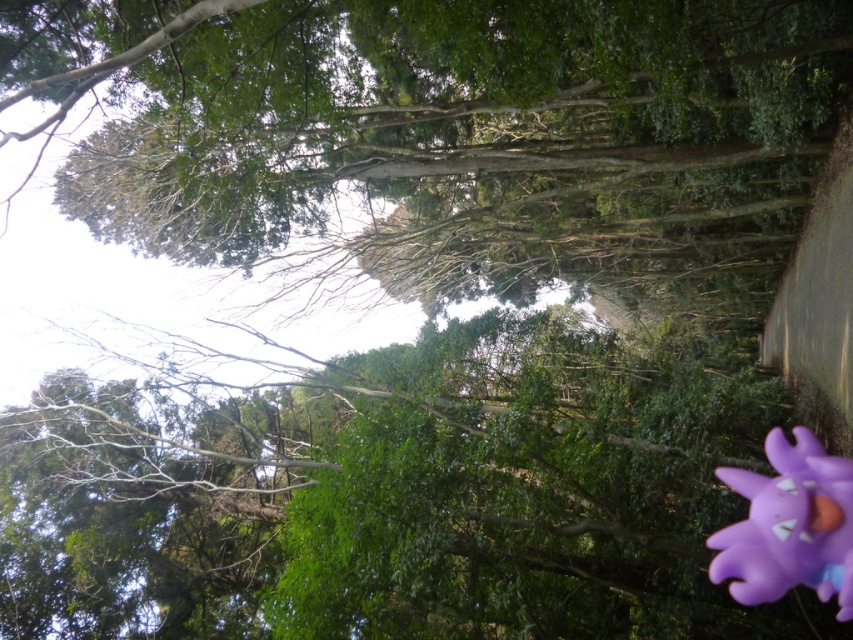
Who is higher up, green leafy tree at center or purple matte toy at lower right?

green leafy tree at center is above.

Describe the element at coordinates (451, 131) in the screenshot. I see `green leafy tree at center` at that location.

Where is `green leafy tree at center`? green leafy tree at center is located at coordinates (451, 131).